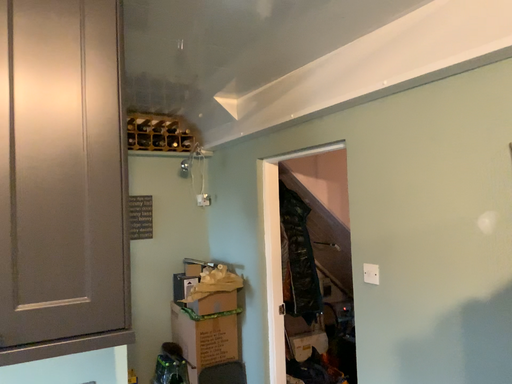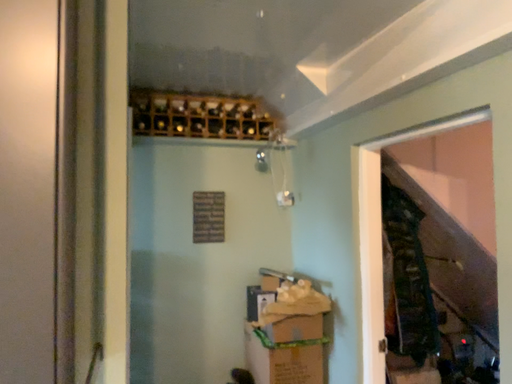
Question: Which way did the camera rotate in the video?

Choices:
 (A) rotated left
 (B) rotated right

Answer: (A)